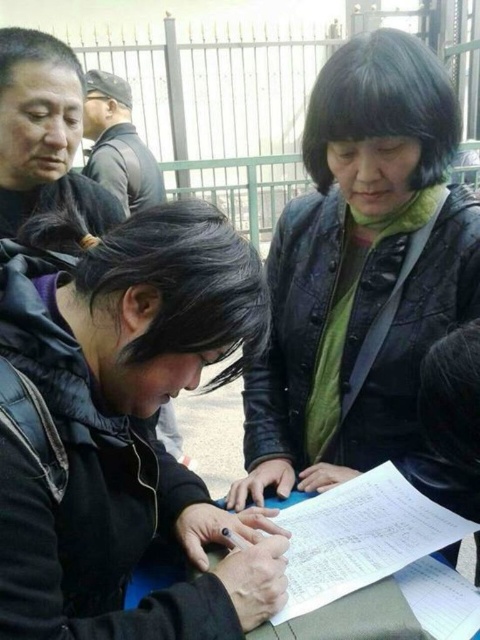
Who is more forward, (252, 509) or (376, 38)?

Point (252, 509) is more forward.

Locate an element on the screen. Image resolution: width=480 pixels, height=640 pixels. black leather jacket at lower left is located at coordinates (122, 429).

Does black leather jacket at upper center appear on the left side of white paper at center?

No, black leather jacket at upper center is not to the left of white paper at center.

Which is in front, point (475, 252) or point (357, 568)?

Point (357, 568) is in front.

The width and height of the screenshot is (480, 640). What are the coordinates of `black leather jacket at upper center` in the screenshot? It's located at (362, 278).

Which is in front, point (92, 449) or point (308, 499)?

Point (92, 449) is in front.

What do you see at coordinates (122, 429) in the screenshot?
I see `black leather jacket at lower left` at bounding box center [122, 429].

At what (x,y) coordinates should I click in order to perform the action: click on black leather jacket at lower left. Please return your answer as a coordinate pair (x, y). The image size is (480, 640). Looking at the image, I should click on coord(122,429).